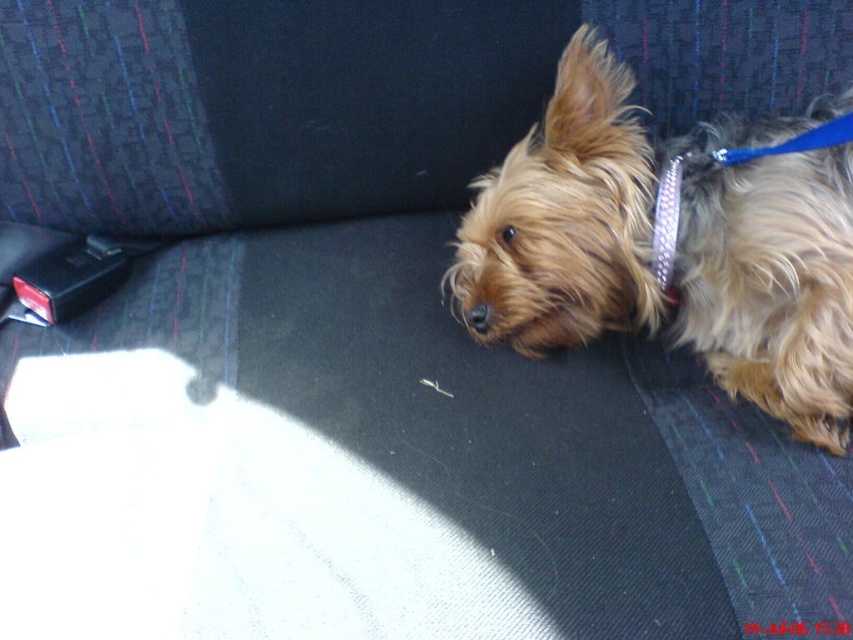
Question: Which point is closer to the camera?

Choices:
 (A) fuzzy brown dog at center
 (B) blue metallic collar at upper right
 (C) glittery silver neckband at upper right

Answer: (A)

Question: Is fuzzy brown dog at center above glittery silver neckband at upper right?

Choices:
 (A) yes
 (B) no

Answer: (A)

Question: Which point appears closest to the camera in this image?

Choices:
 (A) (659, 216)
 (B) (840, 131)
 (C) (628, 150)

Answer: (B)

Question: Estimate the real-world distances between objects in this image. Which object is farther from the glittery silver neckband at upper right?

Choices:
 (A) blue metallic collar at upper right
 (B) fuzzy brown dog at center

Answer: (B)

Question: Can you confirm if fuzzy brown dog at center is bigger than blue metallic collar at upper right?

Choices:
 (A) no
 (B) yes

Answer: (B)

Question: Can you confirm if fuzzy brown dog at center is smaller than glittery silver neckband at upper right?

Choices:
 (A) no
 (B) yes

Answer: (A)